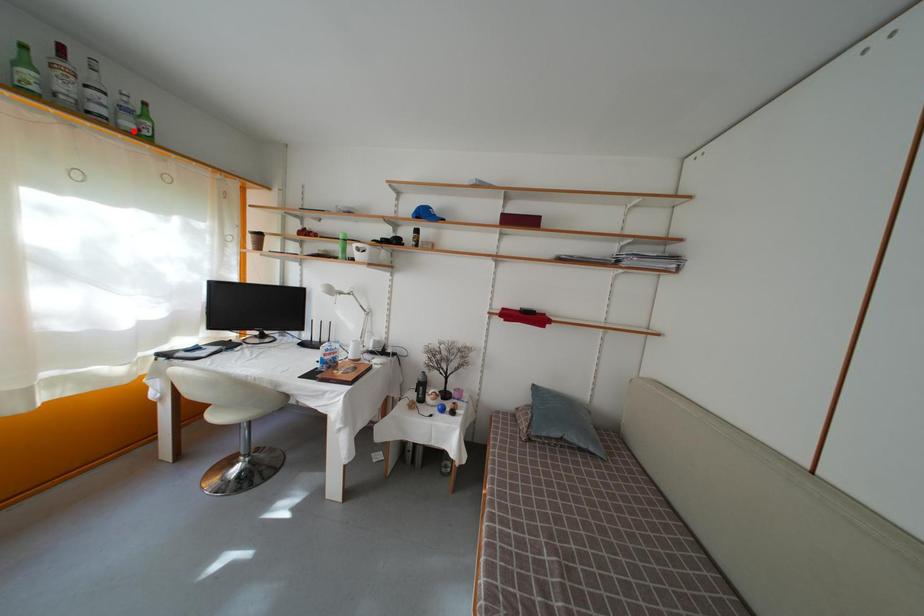
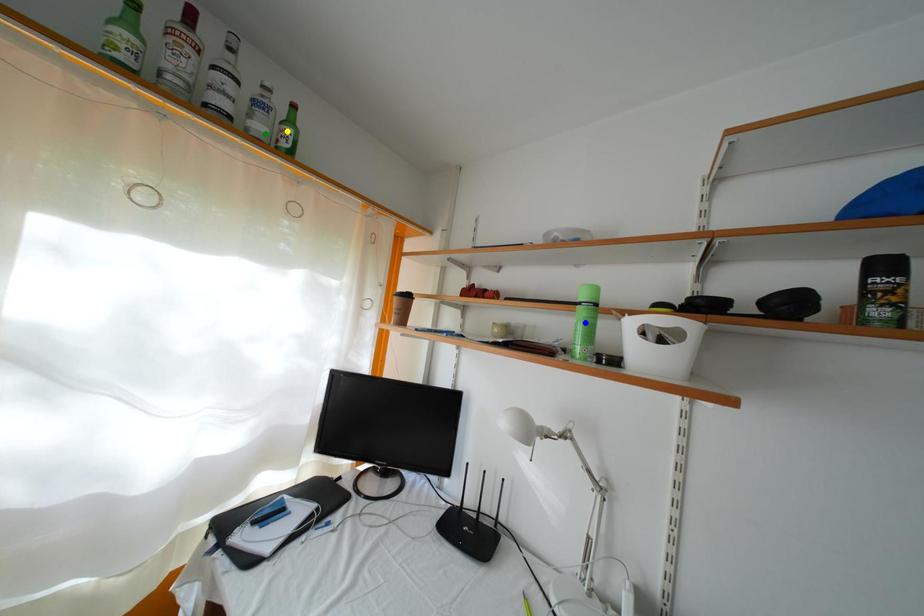
Question: I am providing you with two images of the same scene from different viewpoints. A red point is marked on the first image. You are given multiple points on the second image. In image 2, which mark is for the same physical point as the one in image 1?

Choices:
 (A) yellow point
 (B) green point
 (C) blue point

Answer: (B)